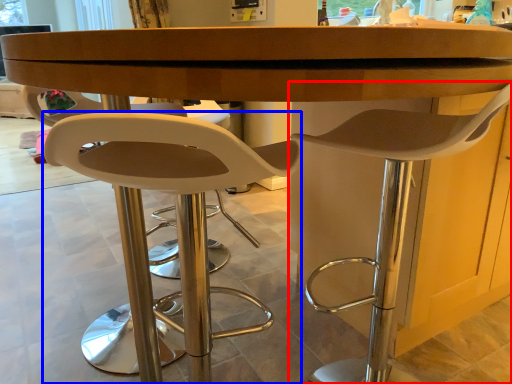
Question: Which object is further to the camera taking this photo, chair (highlighted by a red box) or chair (highlighted by a blue box)?

Choices:
 (A) chair
 (B) chair

Answer: (A)